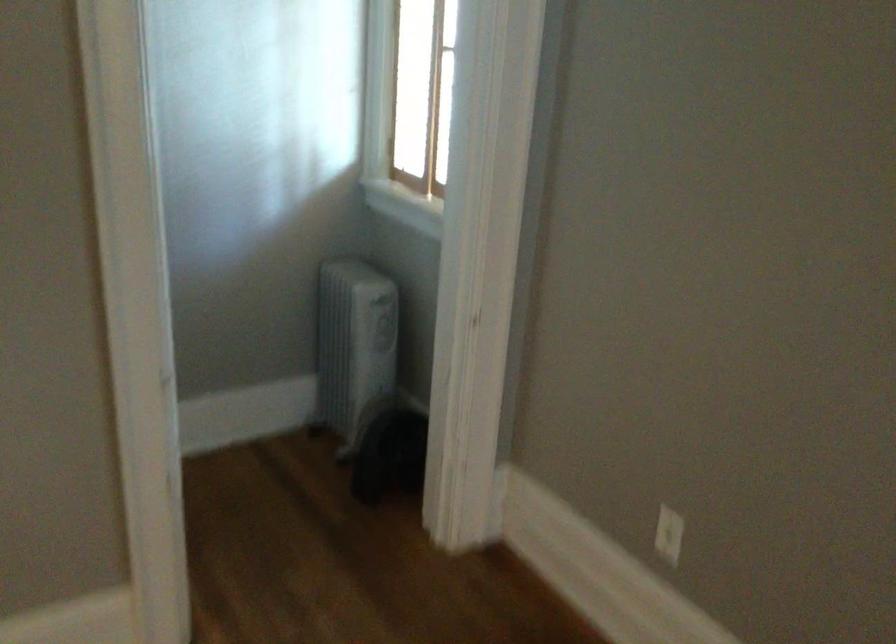
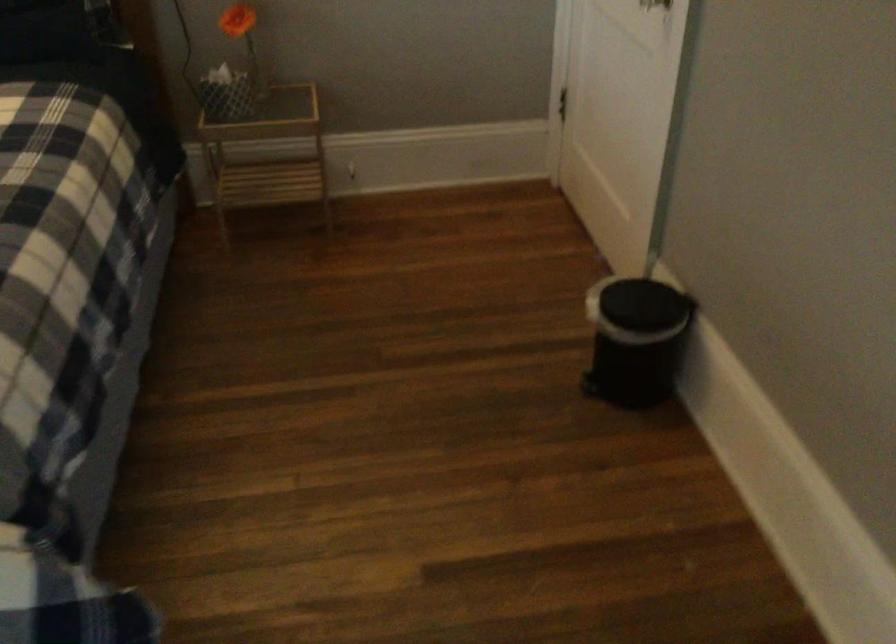
The images are taken continuously from a first-person perspective. In which direction is your viewpoint rotating?

The camera's rotation is toward left-down.